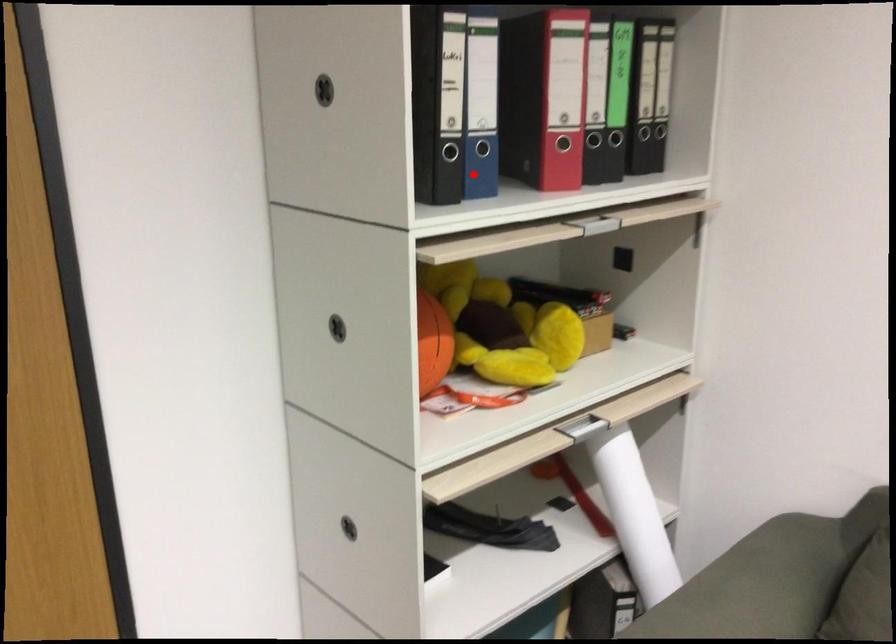
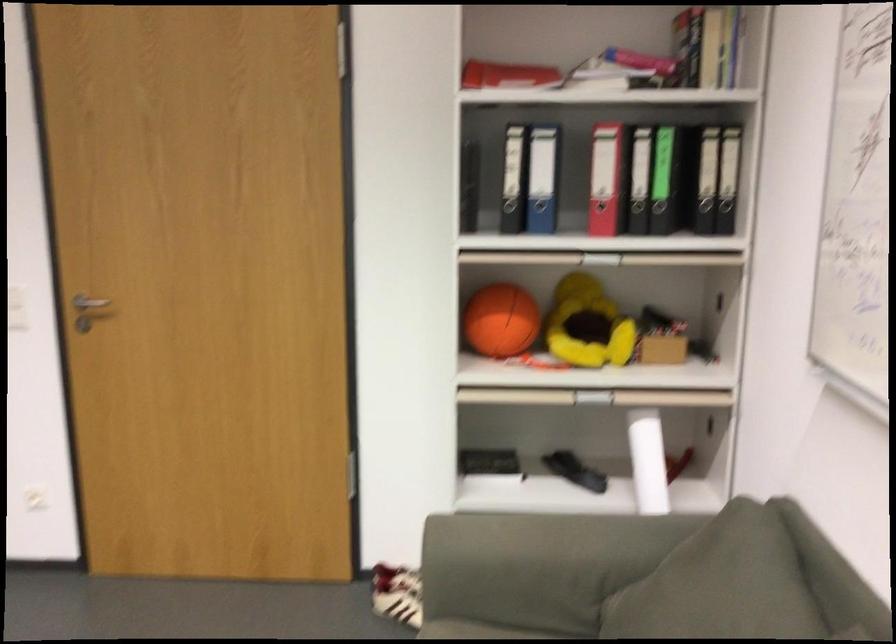
The point at the highlighted location is marked in the first image. Where is the corresponding point in the second image?

(539, 216)